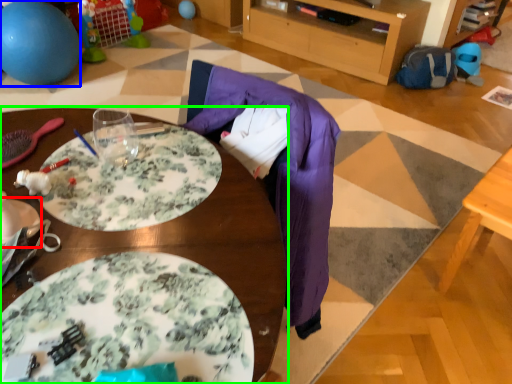
Question: Estimate the real-world distances between objects in this image. Which object is farther from plate (highlighted by a red box), ball (highlighted by a blue box) or table (highlighted by a green box)?

Choices:
 (A) ball
 (B) table

Answer: (A)